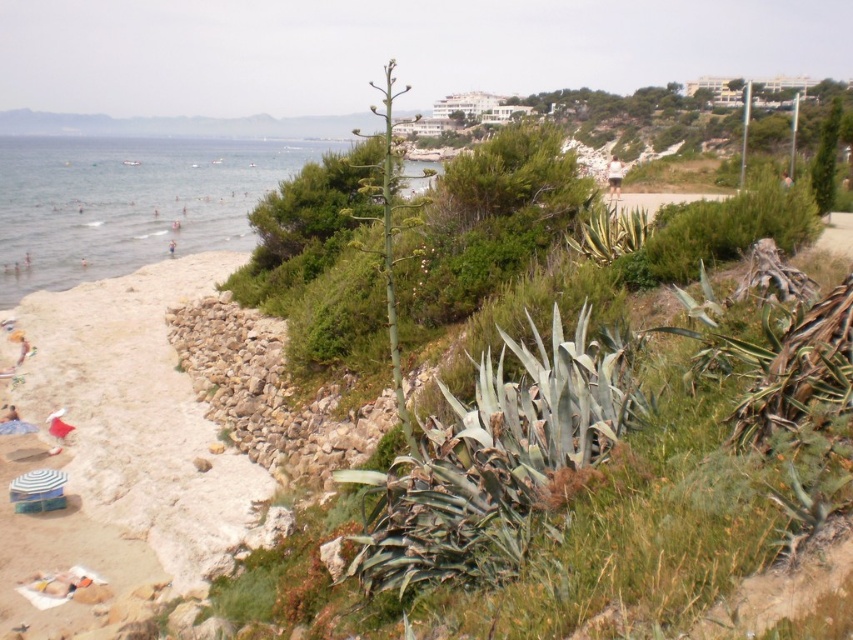
Question: Which point is farther to the camera?

Choices:
 (A) white fabric at lower left
 (B) clear blue water at beach left

Answer: (B)

Question: Can you confirm if beige sand at lower left is positioned below white cotton shorts at upper right?

Choices:
 (A) no
 (B) yes

Answer: (B)

Question: Can you confirm if beige sand at lower left is thinner than white cotton shorts at upper right?

Choices:
 (A) no
 (B) yes

Answer: (B)

Question: Is beige sand at lower left wider than white cotton shorts at upper right?

Choices:
 (A) yes
 (B) no

Answer: (B)

Question: Among these points, which one is nearest to the camera?

Choices:
 (A) [170, 380]
 (B) [57, 412]
 (C) [28, 172]

Answer: (B)

Question: Which object is the closest to the beige sand at lower left?

Choices:
 (A) clear blue water at beach left
 (B) white fabric at lower left
 (C) white cotton shorts at upper right

Answer: (B)